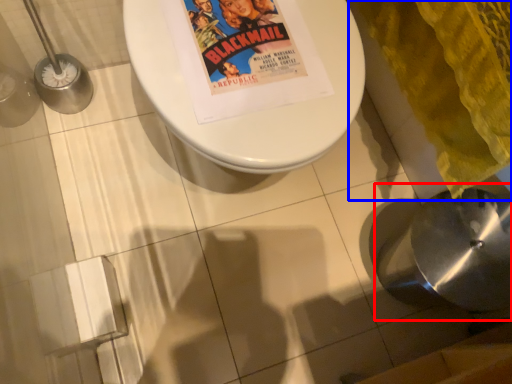
Question: Which of the following is the closest to the observer, sink (highlighted by a red box) or blanket (highlighted by a blue box)?

Choices:
 (A) sink
 (B) blanket

Answer: (B)